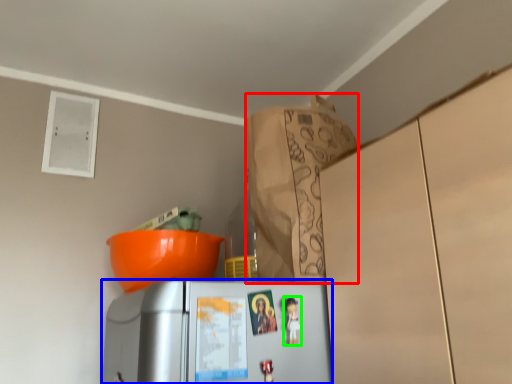
Question: Which object is the closest to the paper bag (highlighted by a red box)? Choose among these: refrigerator (highlighted by a blue box) or toy (highlighted by a green box).

Choices:
 (A) refrigerator
 (B) toy

Answer: (A)